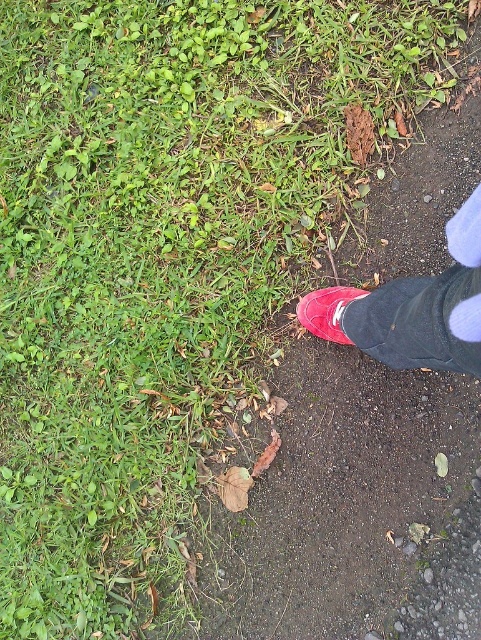
How distant is rubber shoe at lower right from matte red shoe at lower right?

The distance of rubber shoe at lower right from matte red shoe at lower right is 7.72 inches.

Where is `rubber shoe at lower right`? The width and height of the screenshot is (481, 640). rubber shoe at lower right is located at coordinates (413, 308).